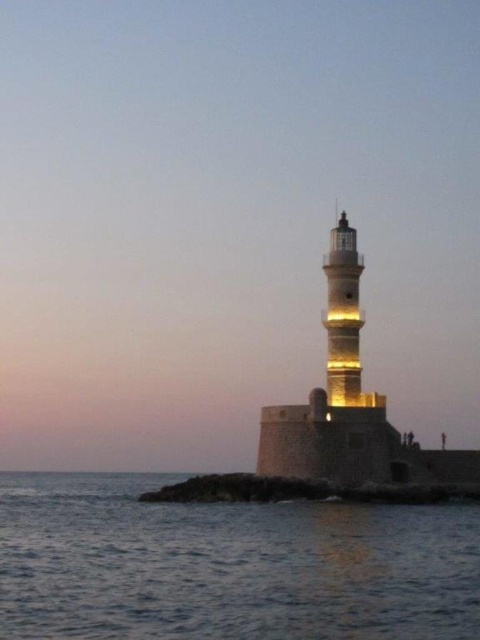
Question: Among these points, which one is farthest from the camera?

Choices:
 (A) (334, 390)
 (B) (420, 570)

Answer: (A)

Question: Considering the relative positions of rusty stone shoreline at lower center and yellowish stone tower at center in the image provided, where is rusty stone shoreline at lower center located with respect to yellowish stone tower at center?

Choices:
 (A) above
 (B) below

Answer: (B)

Question: Which point is farther to the camera?

Choices:
 (A) yellowish stone tower at center
 (B) blue water at lower left

Answer: (A)

Question: Which of these objects is positioned farthest from the blue water at lower left?

Choices:
 (A) yellowish stone tower at center
 (B) rusty stone shoreline at lower center
 (C) light brown stone lighthouse at center

Answer: (A)

Question: Can you confirm if light brown stone lighthouse at center is thinner than yellowish stone tower at center?

Choices:
 (A) no
 (B) yes

Answer: (A)

Question: Does blue water at lower left appear under rusty stone shoreline at lower center?

Choices:
 (A) no
 (B) yes

Answer: (B)